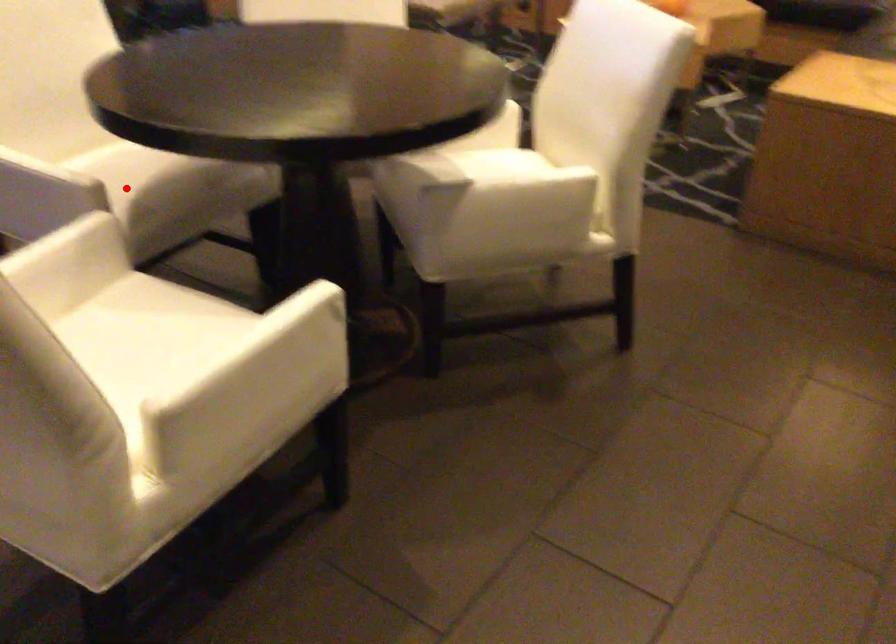
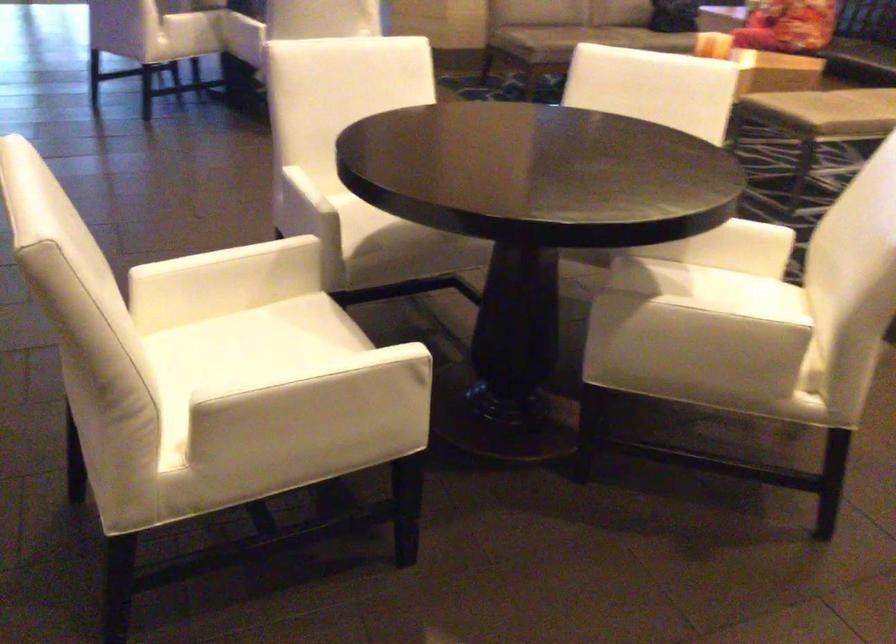
Find the pixel in the second image that matches the highlighted location in the first image.

(372, 223)